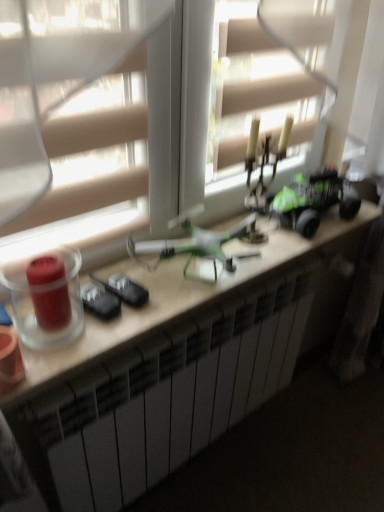
At what (x,y) coordinates should I click in order to perform the action: click on vacant space in front of matte red candle holder at left, which ranks as the second candle holder in left-to-right order. Please return your answer as a coordinate pair (x, y). Image resolution: width=384 pixels, height=512 pixels. Looking at the image, I should click on (49, 358).